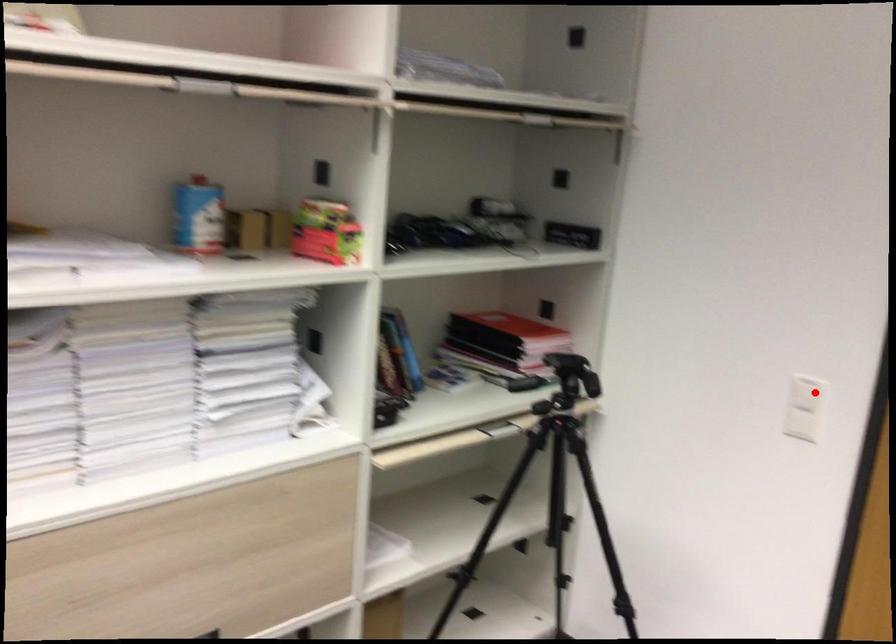
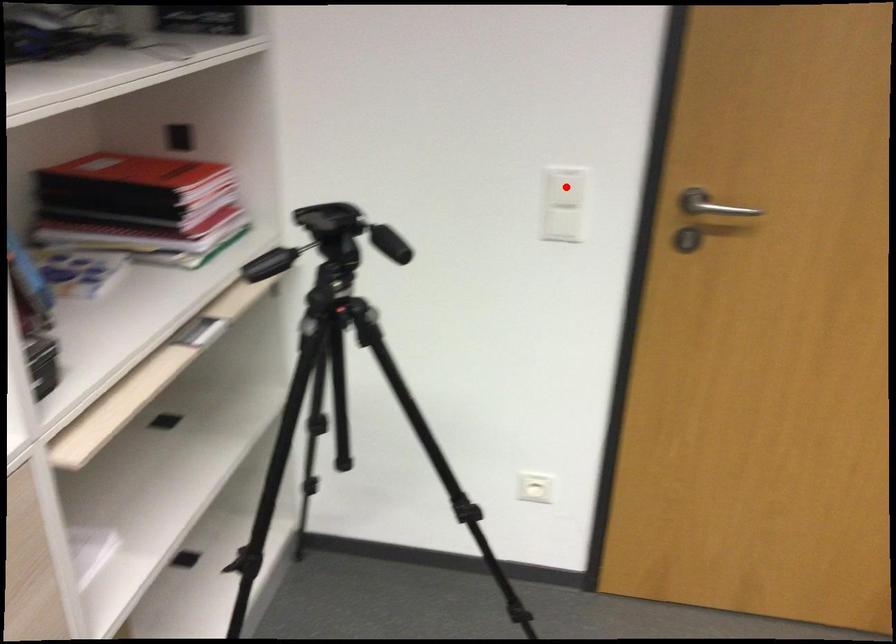
I am providing you with two images of the same scene from different viewpoints. A red point is marked on the first image and another point is marked on the second image. Is the marked point in image1 the same physical position as the marked point in image2?

Yes